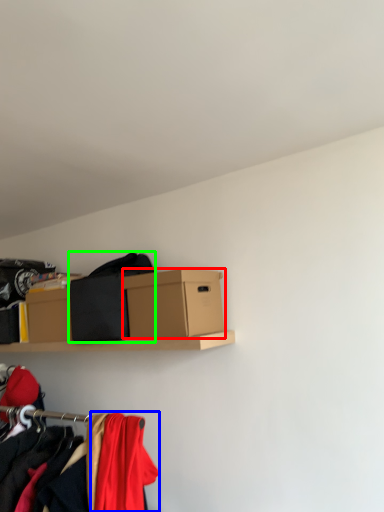
Question: Considering the real-world distances, which object is closest to box (highlighted by a red box)? clothing (highlighted by a blue box) or clothing (highlighted by a green box).

Choices:
 (A) clothing
 (B) clothing

Answer: (B)